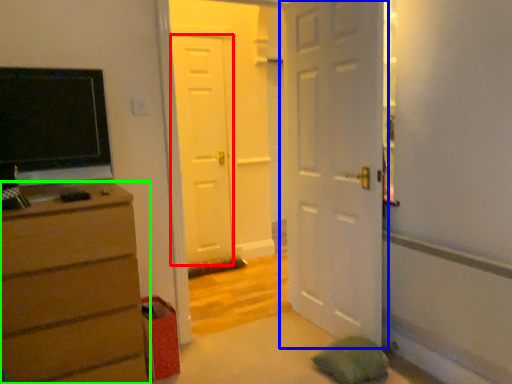
Question: Which object is positioned closest to door (highlighted by a red box)? Select from door (highlighted by a blue box) and chest of drawers (highlighted by a green box).

Choices:
 (A) door
 (B) chest of drawers

Answer: (A)